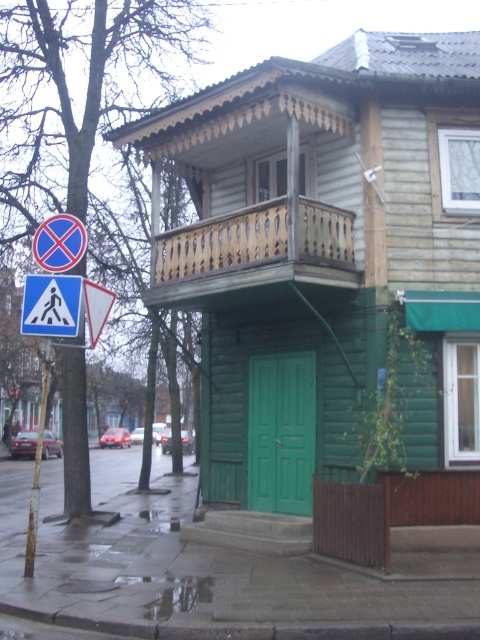
You are a pedestrian standing at the entrance of the wooden house with a green door. You see a point marked at coordinates (50,305). What object is located at that point?

The point at coordinates (50,305) corresponds to the white plastic pedestrian crossing sign at upper left.

You are a pedestrian approaching the house and see the white plastic pedestrian crossing sign at upper left and the blue plastic pedestrian crossing sign at upper left. Which sign is closer to you?

The white plastic pedestrian crossing sign at upper left is closer to you because it is in front of the blue plastic pedestrian crossing sign at upper left.

You are a delivery person with a 16 inch wide box. You need to carry this box through the pedestrian crossing area in front of the house. Can you fit between the white plastic pedestrian crossing sign at upper left and the blue plastic pedestrian crossing sign at upper left?

The white plastic pedestrian crossing sign at upper left and blue plastic pedestrian crossing sign at upper left are 16.76 inches apart. Since your box is 16 inches wide, it will fit between them as there is enough space.